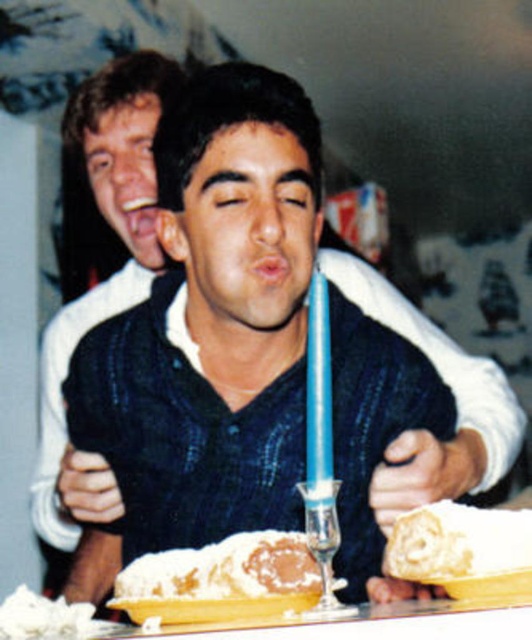
You are a guest at the birthday party and want to take a slice of the white fluffy cake at lower center. Which direction should you move relative to the white powdered cake at center?

The white fluffy cake at lower center is to the right of the white powdered cake at center, so you should move to the right to reach it.

In the scene shown: You are planning to take a photo of the white powdered cake at center during the event. Where should you position yourself relative to the seated man and the blue candle in front of him to ensure the cake is in the frame?

The white powdered cake at center is located at point (221,580), so you should position yourself directly in front of the seated man and the blue candle to capture the cake in the center of the image.